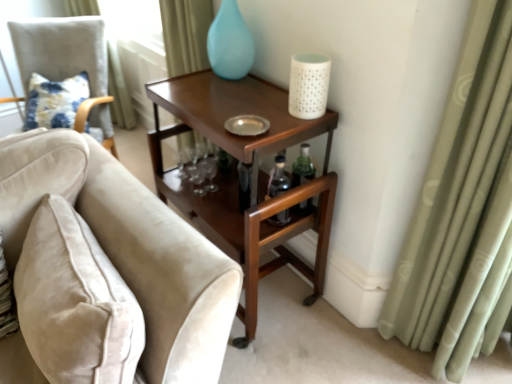
You are a GUI agent. You are given a task and a screenshot of the screen. Output one action in this format:
    pyautogui.click(x=<x>, y=<y>)
    Task: Click on the velvet beige sofa at left, marked as the 1th chair in a right-to-left arrangement
    
    Given the screenshot: What is the action you would take?
    pyautogui.click(x=130, y=248)

What is the approximate width of mahogany wood side table at upper right?

The width of mahogany wood side table at upper right is 47.94 centimeters.

I want to click on green fabric curtain at right, acting as the 2th curtain starting from the top, so click(x=463, y=211).

Where is `matte blue glass vase at upper center`? This screenshot has width=512, height=384. matte blue glass vase at upper center is located at coordinates point(230,43).

Describe the element at coordinates (62, 49) in the screenshot. This screenshot has height=384, width=512. I see `velvet beige chair at left, acting as the second chair starting from the front` at that location.

What do you see at coordinates (55, 101) in the screenshot?
I see `floral fabric cushion at left` at bounding box center [55, 101].

Where is `light green fabric curtain at upper left, which is counted as the 1th curtain, starting from the left`? This screenshot has width=512, height=384. light green fabric curtain at upper left, which is counted as the 1th curtain, starting from the left is located at coordinates (185, 34).

Looking at this image, is matte blue glass vase at upper center at the back of white textured candle at upper right?

No, white textured candle at upper right is not facing the opposite direction of matte blue glass vase at upper center.

Can you confirm if white textured candle at upper right is positioned to the right of matte blue glass vase at upper center?

Yes.

In the image, there is a white textured candle at upper right. Where is `glass vase above it (from the image's perspective)`? Image resolution: width=512 pixels, height=384 pixels. glass vase above it (from the image's perspective) is located at coordinates (230, 43).

Which is farther, (307, 114) or (225, 39)?

The point (225, 39) is farther from the camera.

From a real-world perspective, is velvet beige chair at left, the 1th chair when ordered from left to right, positioned above or below matte blue glass vase at upper center?

velvet beige chair at left, the 1th chair when ordered from left to right, is below matte blue glass vase at upper center.

Visually, is velvet beige chair at left, the 2th chair positioned from the right, positioned to the left or to the right of matte blue glass vase at upper center?

Based on their positions, velvet beige chair at left, the 2th chair positioned from the right, is located to the left of matte blue glass vase at upper center.

Where is `glass vase on the right of velvet beige chair at left, acting as the second chair starting from the front`? This screenshot has width=512, height=384. glass vase on the right of velvet beige chair at left, acting as the second chair starting from the front is located at coordinates (230, 43).

How different are the orientations of velvet beige chair at left, the 1th chair when ordered from left to right, and matte blue glass vase at upper center in degrees?

The angular difference between velvet beige chair at left, the 1th chair when ordered from left to right, and matte blue glass vase at upper center is 48.3 degrees.

Is white textured candle at upper right situated inside floral fabric cushion at left or outside?

white textured candle at upper right exists outside the volume of floral fabric cushion at left.

Is white textured candle at upper right closer to camera compared to floral fabric cushion at left?

Yes, it is in front of floral fabric cushion at left.

This screenshot has width=512, height=384. I want to click on candle holder that is below the floral fabric cushion at left (from the image's perspective), so click(x=309, y=85).

Measure the distance between white textured candle at upper right and floral fabric cushion at left.

They are 5.32 feet apart.

From the picture: Considering the sizes of objects velvet beige sofa at left, acting as the first chair starting from the front, and mahogany wood side table at upper right in the image provided, who is taller, velvet beige sofa at left, acting as the first chair starting from the front, or mahogany wood side table at upper right?

With more height is mahogany wood side table at upper right.

What's the angular difference between velvet beige sofa at left, acting as the first chair starting from the front, and mahogany wood side table at upper right's facing directions?

The facing directions of velvet beige sofa at left, acting as the first chair starting from the front, and mahogany wood side table at upper right are 87.3 degrees apart.

Which of these two, velvet beige sofa at left, which appears as the second chair when viewed from the left, or mahogany wood side table at upper right, is wider?

velvet beige sofa at left, which appears as the second chair when viewed from the left, is wider.

From the image's perspective, is velvet beige sofa at left, acting as the first chair starting from the front, under mahogany wood side table at upper right?

Yes, from the image's perspective, velvet beige sofa at left, acting as the first chair starting from the front, is below mahogany wood side table at upper right.

Between mahogany wood side table at upper right and velvet beige sofa at left, which appears as the second chair when viewed from the left, which one has smaller size?

With smaller size is velvet beige sofa at left, which appears as the second chair when viewed from the left.

From a real-world perspective, is mahogany wood side table at upper right beneath velvet beige sofa at left, acting as the first chair starting from the front?

Yes, from a real-world perspective, mahogany wood side table at upper right is below velvet beige sofa at left, acting as the first chair starting from the front.

What's the angular difference between mahogany wood side table at upper right and velvet beige sofa at left, arranged as the 2th chair when viewed from the back,'s facing directions?

mahogany wood side table at upper right and velvet beige sofa at left, arranged as the 2th chair when viewed from the back, are facing 87.3 degrees away from each other.

Does mahogany wood side table at upper right contain velvet beige sofa at left, arranged as the 2th chair when viewed from the back?

Definitely not — velvet beige sofa at left, arranged as the 2th chair when viewed from the back, is not inside mahogany wood side table at upper right.

In the scene shown: Is velvet beige chair at left, acting as the second chair starting from the front, inside or outside of floral fabric cushion at left?

velvet beige chair at left, acting as the second chair starting from the front, is outside floral fabric cushion at left.

Can you confirm if velvet beige chair at left, acting as the second chair starting from the front, is shorter than floral fabric cushion at left?

Incorrect, the height of velvet beige chair at left, acting as the second chair starting from the front, does not fall short of that of floral fabric cushion at left.

In the scene shown: Is velvet beige chair at left, the 1th chair when ordered from left to right, far from floral fabric cushion at left?

No, there isn't a large distance between velvet beige chair at left, the 1th chair when ordered from left to right, and floral fabric cushion at left.

From the picture: Which of these two, velvet beige chair at left, acting as the second chair starting from the front, or floral fabric cushion at left, is thinner?

floral fabric cushion at left.

In the image, is green fabric curtain at right, the 2th curtain when ordered from left to right, on the left side or the right side of matte blue glass vase at upper center?

green fabric curtain at right, the 2th curtain when ordered from left to right, is positioned on matte blue glass vase at upper center's right side.

Are green fabric curtain at right, which is the 1th curtain from front to back, and matte blue glass vase at upper center located far from each other?

No.

The image size is (512, 384). In order to click on glass vase behind the white textured candle at upper right in this screenshot , I will do `click(230, 43)`.

The width and height of the screenshot is (512, 384). Find the location of `glass vase that appears in front of the velvet beige chair at left, which is counted as the first chair, starting from the back`. glass vase that appears in front of the velvet beige chair at left, which is counted as the first chair, starting from the back is located at coordinates (230, 43).

Consider the image. From the image, which object appears to be nearer to white textured candle at upper right, velvet beige sofa at left, marked as the 1th chair in a right-to-left arrangement, or floral fabric cushion at left?

Among the two, velvet beige sofa at left, marked as the 1th chair in a right-to-left arrangement, is located nearer to white textured candle at upper right.

Considering their positions, is velvet beige chair at left, acting as the second chair starting from the front, positioned further to floral fabric cushion at left than matte blue glass vase at upper center?

matte blue glass vase at upper center is positioned further to the anchor floral fabric cushion at left.

When comparing their distances from green fabric curtain at right, which appears as the 1th curtain when ordered from the bottom, does white textured candle at upper right or velvet beige chair at left, the 1th chair when ordered from left to right, seem closer?

white textured candle at upper right is positioned closer to the anchor green fabric curtain at right, which appears as the 1th curtain when ordered from the bottom.

Based on their spatial positions, is matte blue glass vase at upper center or mahogany wood side table at upper right further from velvet beige sofa at left, arranged as the 2th chair when viewed from the back?

matte blue glass vase at upper center.

Which object lies further to the anchor point floral fabric cushion at left, velvet beige chair at left, the 2th chair positioned from the right, or mahogany wood side table at upper right?

mahogany wood side table at upper right.

Consider the image. Based on their spatial positions, is floral fabric cushion at left or velvet beige chair at left, acting as the second chair starting from the front, closer to white textured candle at upper right?

floral fabric cushion at left lies closer to white textured candle at upper right than the other object.

Looking at the image, which one is located further to velvet beige sofa at left, marked as the 1th chair in a right-to-left arrangement, green fabric curtain at right, which appears as the first curtain when viewed from the right, or floral fabric cushion at left?

The object further to velvet beige sofa at left, marked as the 1th chair in a right-to-left arrangement, is floral fabric cushion at left.

Looking at this image, estimate the real-world distances between objects in this image. Which object is closer to floral fabric cushion at left, green fabric curtain at right, positioned as the 2th curtain in back-to-front order, or mahogany wood side table at upper right?

Among the two, mahogany wood side table at upper right is located nearer to floral fabric cushion at left.

Identify the location of table between velvet beige sofa at left, acting as the first chair starting from the front, and floral fabric cushion at left, along the z-axis. Image resolution: width=512 pixels, height=384 pixels. (249, 176).

What are the coordinates of `glass vase between floral fabric cushion at left and mahogany wood side table at upper right` in the screenshot? It's located at (230, 43).

Image resolution: width=512 pixels, height=384 pixels. Identify the location of table between velvet beige sofa at left, arranged as the 2th chair when viewed from the back, and white textured candle at upper right from left to right. (249, 176).

This screenshot has height=384, width=512. I want to click on candle holder between velvet beige sofa at left, acting as the first chair starting from the front, and green fabric curtain at right, positioned as the 2th curtain in back-to-front order, in the horizontal direction, so click(x=309, y=85).